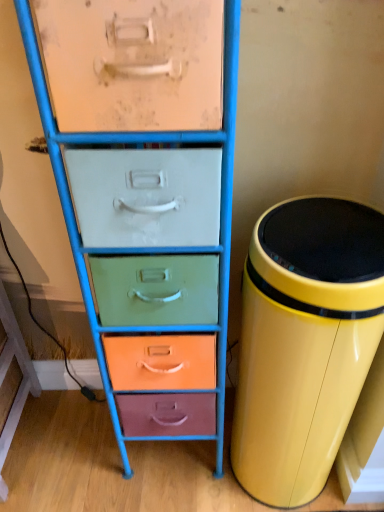
Find the location of a particular element. The height and width of the screenshot is (512, 384). free space that is in between metallic drawer unit at center and yellow glossy trash can at right is located at coordinates (185, 498).